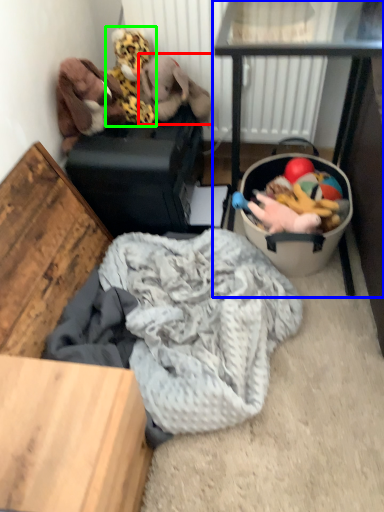
Question: Estimate the real-world distances between objects in this image. Which object is closer to animal (highlighted by a red box), table (highlighted by a blue box) or toy (highlighted by a green box)?

Choices:
 (A) table
 (B) toy

Answer: (B)